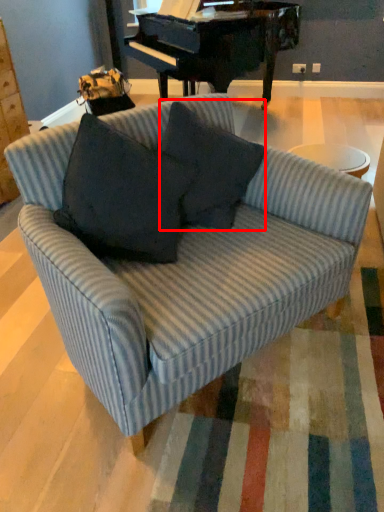
Question: From the image's perspective, where is throw pillow (annotated by the red box) located relative to studio couch?

Choices:
 (A) below
 (B) above

Answer: (B)